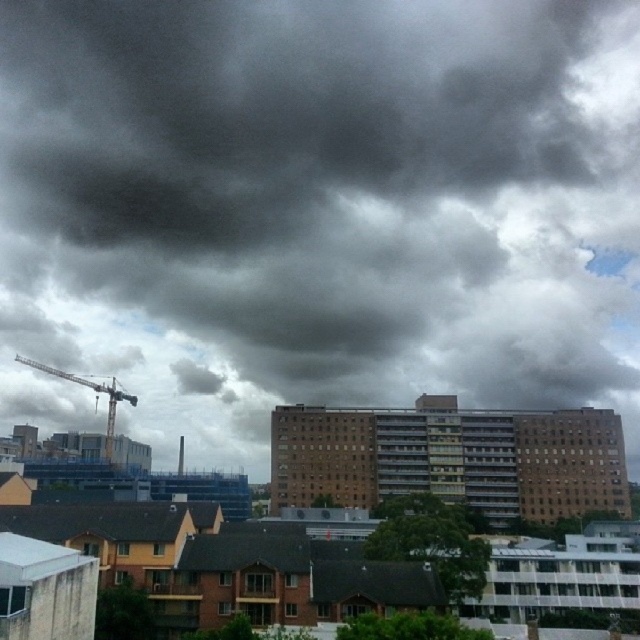
You are standing in the city and want to take a photo of the two points mentioned. Which point, point (506, 280) or point (115, 400), will appear closer to the camera in your photo?

Point (506, 280) is further to the viewer than point (115, 400), so in the photo, point (506, 280) will appear closer to the camera.

You are a pilot preparing to land a small plane at an airport near this city. You notice the dark gray cloud at upper center and the metallic gray crane at left in your line of sight. Which object is higher in the sky?

The dark gray cloud at upper center is located above the metallic gray crane at left, so the dark gray cloud at upper center is higher in the sky.